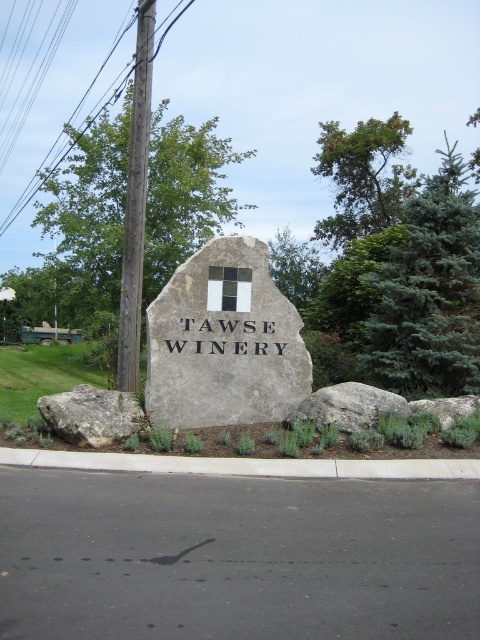
You are a landscape architect designing a pathway around the gray stone sign at center and the gray rough rock at center. Which object requires a wider pathway to accommodate its size?

The gray stone sign at center requires a wider pathway because its width is larger than the gray rough rock at center.

You are driving a car that is 6 feet long. You see the white concrete curb at lower center and the gray rock at center ahead. Can your car fit between them without touching either?

The distance between the white concrete curb at lower center and the gray rock at center is 6.36 feet, which is slightly longer than the car length of 6 feet. Therefore, the car can fit between them without touching either.

You are planning to place a new decorative item between the wooden utility pole at left and the gray rock at center. Which object should you use as a reference for the placement to ensure the item is proportionally sized?

You should use the wooden utility pole at left as a reference because it has a larger size compared to the gray rock at center, so the new item should be proportionally sized relative to the larger pole.